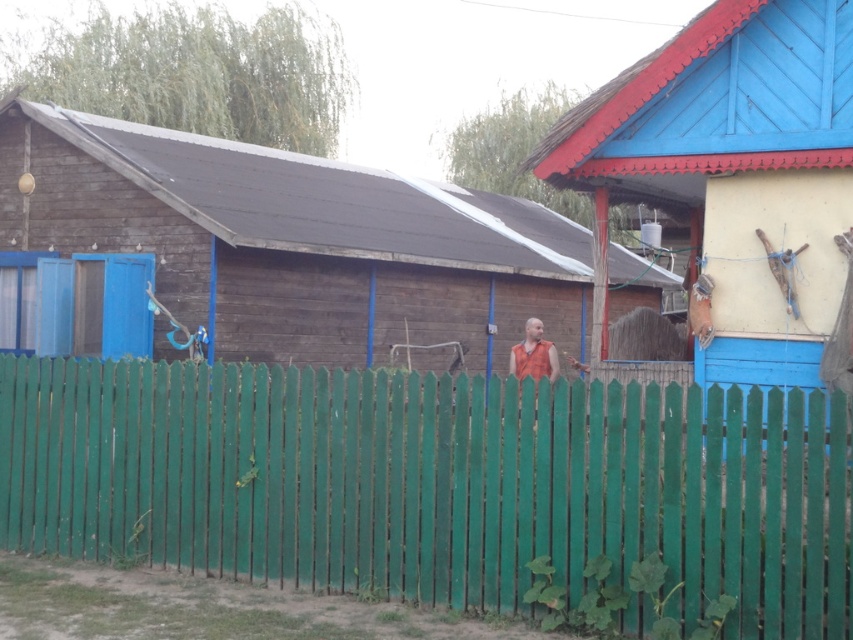
You are standing at the entrance of the shed on the left and want to walk to the colorful building on the right. Which direction should you walk relative to the green wooden fence at center?

The green wooden fence at center is located at point (436, 483), so you should walk around the green wooden fence at center towards the right to reach the colorful building on the right.

You are standing at the center of the rural scene and want to place a new garden ornament between the blue wooden hut at right and the orange fabric vest at center. Based on their positions, where should you place the ornament?

The blue wooden hut at right is located above the orange fabric vest at center, so you should place the garden ornament below the blue wooden hut at right and above the orange fabric vest at center to position it between them.

In the scene shown: What are the coordinates of the green wooden fence at center?

The green wooden fence at center is located at coordinates point (x=436, y=483).